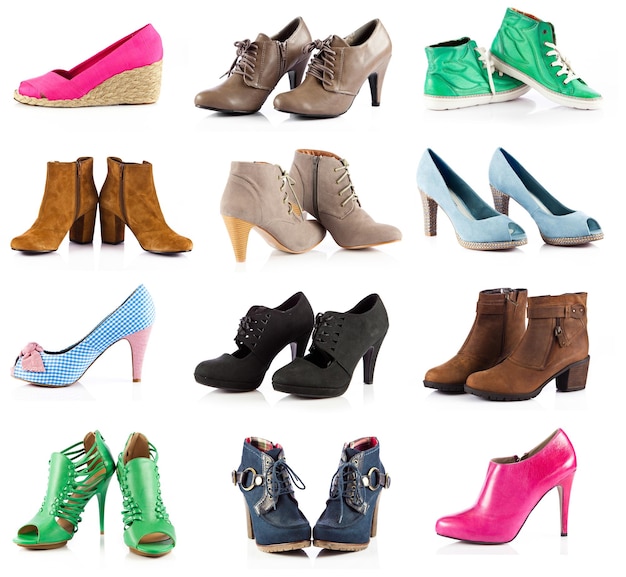
This screenshot has width=626, height=577. Find the location of `pairs of shoes`. pairs of shoes is located at coordinates (287, 99), (156, 205), (302, 217), (513, 52), (491, 176), (548, 340), (294, 342), (305, 526), (101, 464).